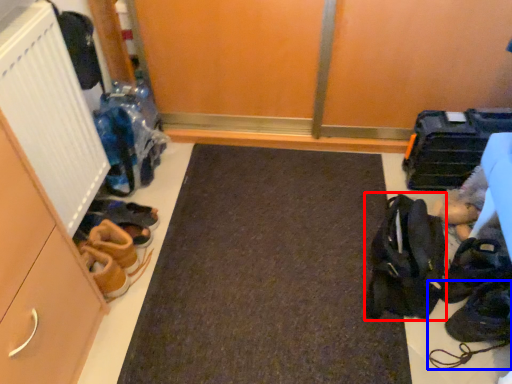
Question: Among these objects, which one is nearest to the camera, accessory (highlighted by a red box) or footwear (highlighted by a blue box)?

Choices:
 (A) accessory
 (B) footwear

Answer: (A)